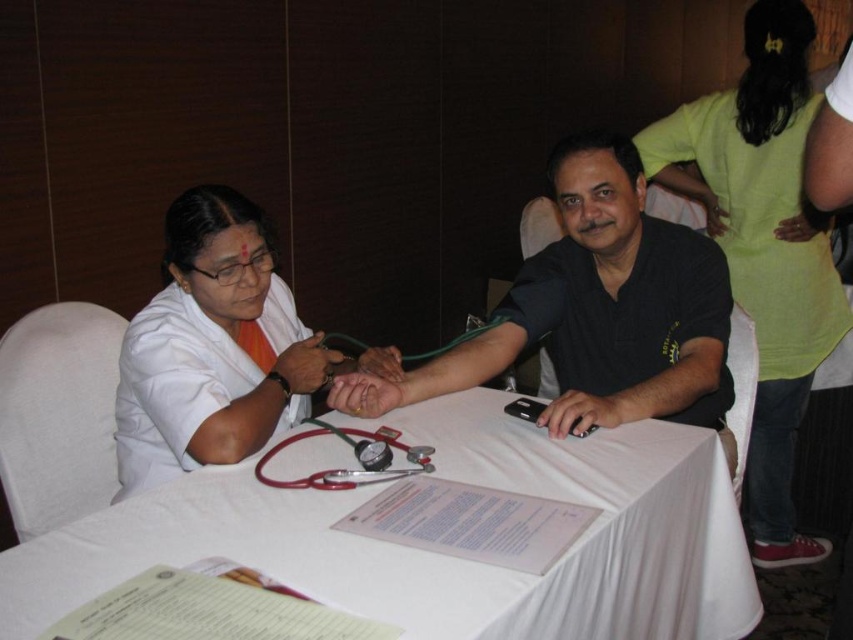
Question: Is black matte shirt at center above red rubber stethoscope at center?

Choices:
 (A) no
 (B) yes

Answer: (B)

Question: Which point is closer to the camera taking this photo?

Choices:
 (A) (215, 492)
 (B) (718, 340)

Answer: (A)

Question: Does white cloth-covered table at center appear under red rubber stethoscope at center?

Choices:
 (A) yes
 (B) no

Answer: (A)

Question: Which point is farther from the camera taking this photo?

Choices:
 (A) (566, 204)
 (B) (373, 467)

Answer: (A)

Question: Which point is closer to the camera taking this photo?

Choices:
 (A) (178, 518)
 (B) (722, 371)

Answer: (A)

Question: Can you confirm if white cloth-covered table at center is positioned to the left of red rubber stethoscope at center?

Choices:
 (A) no
 (B) yes

Answer: (A)